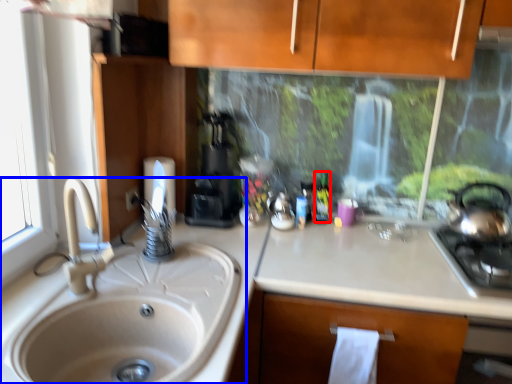
Question: Which point is further to the camera, bottle (highlighted by a red box) or sink (highlighted by a blue box)?

Choices:
 (A) bottle
 (B) sink

Answer: (A)